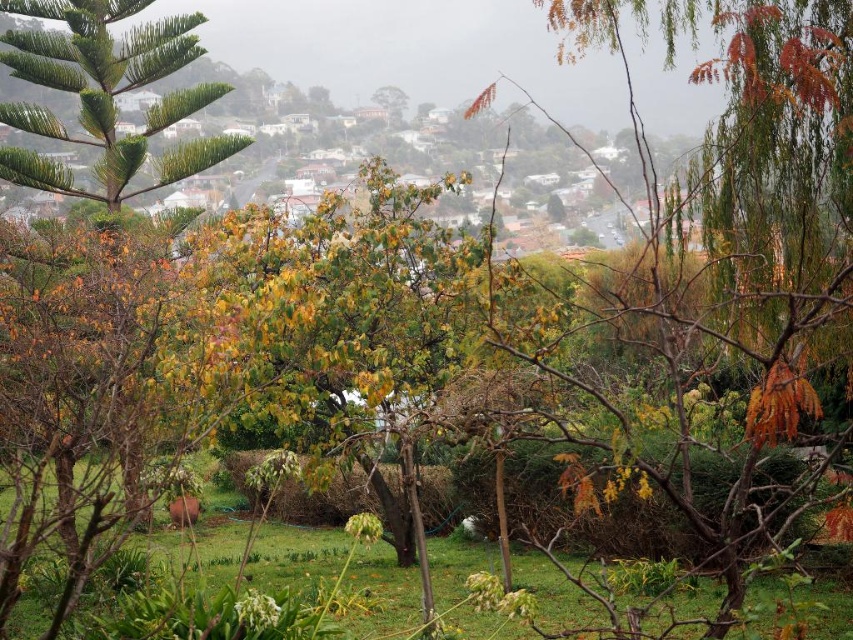
You are standing at the center of the garden and want to place a small potted plant. Where is the best location to place it so that it sits on the green grass at center?

The best location to place the small potted plant is at point (x=294, y=556) where the green grass at center is located.

You are standing at the center of the garden and see the point marked at coordinates (294, 556). What is located at that point?

The point at coordinates (294, 556) corresponds to green grass at center.

You are standing in the garden and want to place a small statue between the two points, point (451, 572) and point (396, 113). Which point should the statue be closer to in order to be nearer to the viewer?

The statue should be closer to point (451, 572) because it is nearer to the viewer compared to point (396, 113).